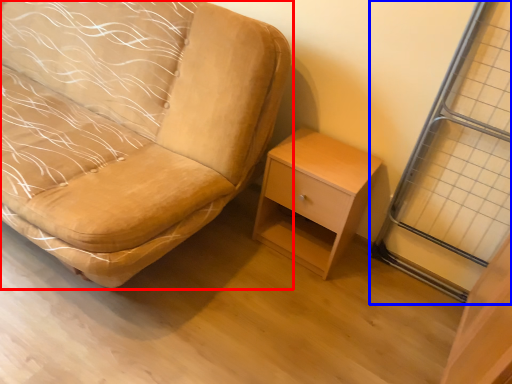
Question: Which point is further to the camera, chair (highlighted by a red box) or screen door (highlighted by a blue box)?

Choices:
 (A) chair
 (B) screen door

Answer: (B)